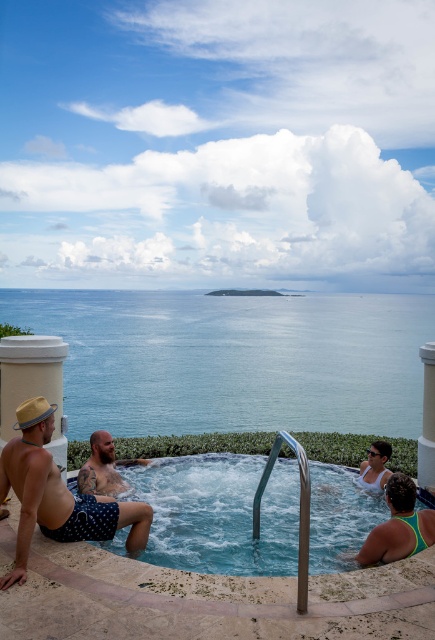
From the picture: Does blue water at lower center appear over clear plastic hot tub at center?

Yes, blue water at lower center is above clear plastic hot tub at center.

Does blue water at lower center lie in front of clear plastic hot tub at center?

No, blue water at lower center is further to the viewer.

Does point (154, 403) come in front of point (248, 536)?

No, (154, 403) is further to viewer.

Locate an element on the screen. This screenshot has width=435, height=640. blue water at lower center is located at coordinates (234, 358).

Who is shorter, blue water at lower center or polka dot swim trunks at left?

With less height is polka dot swim trunks at left.

Which is above, blue water at lower center or polka dot swim trunks at left?

blue water at lower center

What are the coordinates of `blue water at lower center` in the screenshot? It's located at (234, 358).

Locate an element on the screen. Image resolution: width=435 pixels, height=640 pixels. blue water at lower center is located at coordinates (234, 358).

How distant is polka dot swim trunks at left from white matte swimsuit at lower right?

9.45 feet

Where is `polka dot swim trunks at left`? The image size is (435, 640). polka dot swim trunks at left is located at coordinates (56, 493).